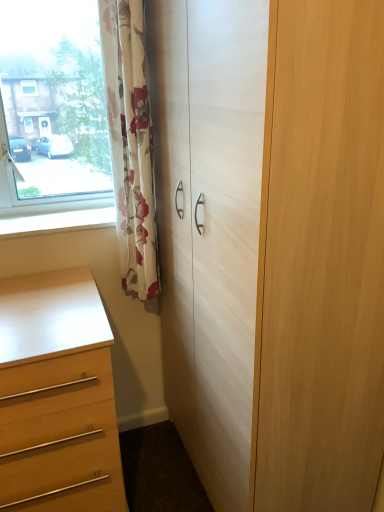
Locate an element on the screen. The width and height of the screenshot is (384, 512). vacant space situated above white glossy window sill at lower left (from a real-world perspective) is located at coordinates (64, 218).